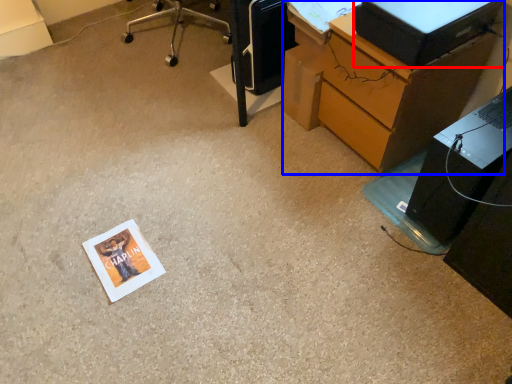
Question: Which of the following is the farthest to the observer, desktop computer (highlighted by a red box) or desk (highlighted by a blue box)?

Choices:
 (A) desktop computer
 (B) desk

Answer: (B)